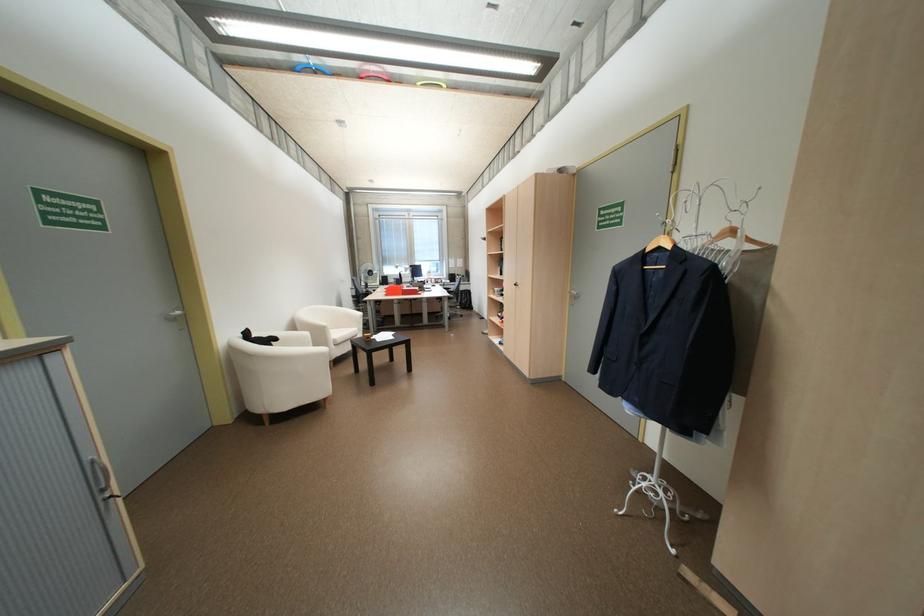
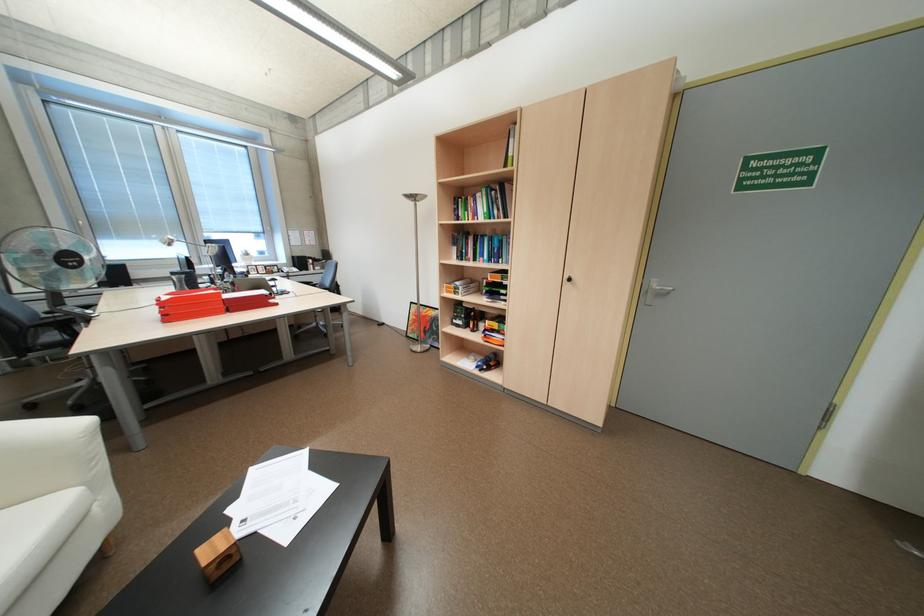
Locate, in the second image, the point that corresponds to (x=508, y=315) in the first image.

(468, 325)